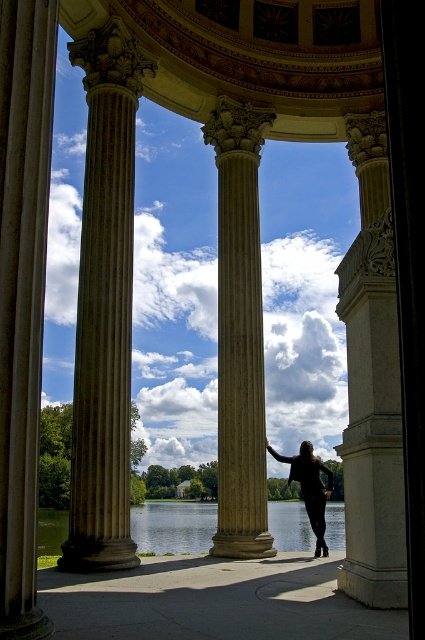
Is point (34, 413) positioned after point (325, 492)?

No, it is not.

Describe the element at coordinates (22, 294) in the screenshot. The height and width of the screenshot is (640, 425). I see `polished stone column at left` at that location.

The width and height of the screenshot is (425, 640). I want to click on polished stone column at left, so click(22, 294).

Looking at this image, which of these two, polished stone column at left or green water at center, stands shorter?

green water at center

Measure the distance between polished stone column at left and green water at center.

polished stone column at left is 34.51 meters from green water at center.

Who is more distant from viewer, (19, 13) or (269, 524)?

Point (269, 524)

Where is `polished stone column at left`? The image size is (425, 640). polished stone column at left is located at coordinates (22, 294).

Which of these two, marble column at center or black matte dress at center, stands taller?

Standing taller between the two is marble column at center.

Does point (237, 253) come behind point (325, 472)?

No, it is not.

Find the location of a particular element. The height and width of the screenshot is (640, 425). marble column at center is located at coordinates (240, 332).